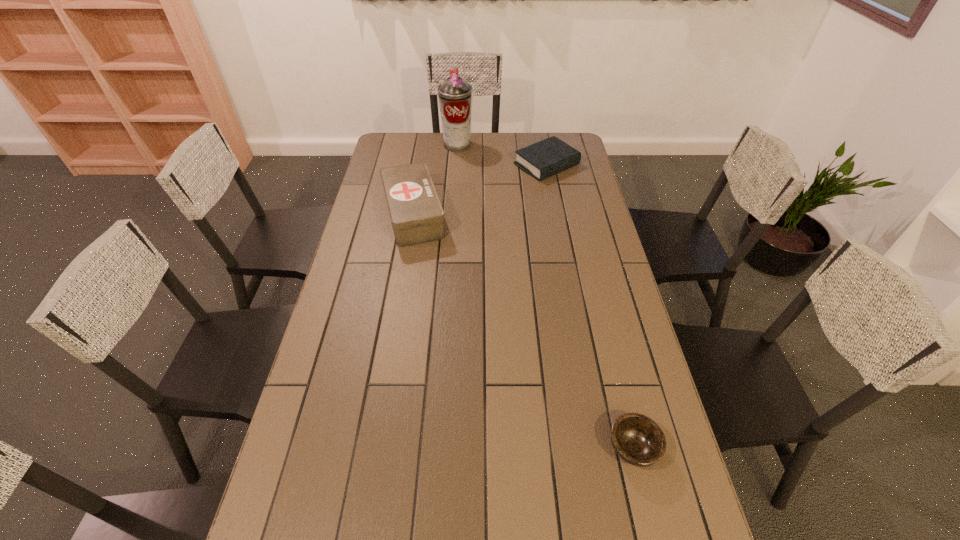
Where is `the tallest object`? The height and width of the screenshot is (540, 960). the tallest object is located at coordinates (455, 95).

In order to click on the second nearest object in this screenshot , I will do `click(416, 214)`.

Find the location of a particular element. the first-aid kit is located at coordinates (416, 214).

At what (x,y) coordinates should I click in order to perform the action: click on Bible. Please return your answer as a coordinate pair (x, y). The image size is (960, 540). Looking at the image, I should click on (543, 159).

The height and width of the screenshot is (540, 960). In order to click on bowl in this screenshot , I will do `click(638, 440)`.

The height and width of the screenshot is (540, 960). I want to click on vacant space located on the right of the aerosol can, so click(x=484, y=145).

Where is `free space located on the right of the first-aid kit`? free space located on the right of the first-aid kit is located at coordinates (553, 214).

Identify the location of free location located 0.380m on the left of the Bible. (426, 165).

The height and width of the screenshot is (540, 960). I want to click on vacant area located 0.210m on the left of the nearest object, so click(x=519, y=448).

Image resolution: width=960 pixels, height=540 pixels. I want to click on aerosol can that is at the far edge, so click(x=455, y=95).